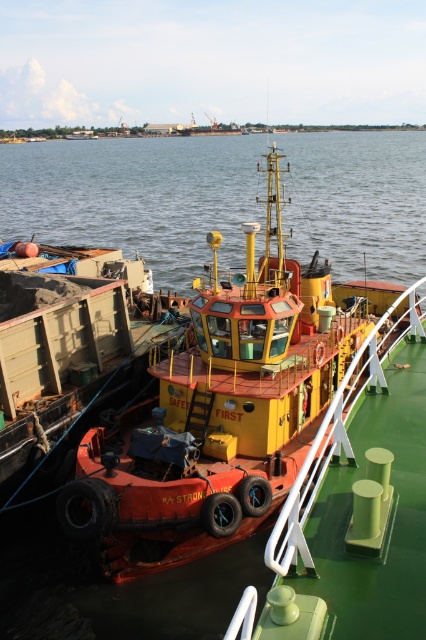
Does orange rubber boat at center appear on the left side of clear water at center?

No, orange rubber boat at center is not to the left of clear water at center.

Can you confirm if orange rubber boat at center is taller than clear water at center?

In fact, orange rubber boat at center may be shorter than clear water at center.

Does point (244, 509) come farther from viewer compared to point (389, 273)?

No.

You are a GUI agent. You are given a task and a screenshot of the screen. Output one action in this format:
    pyautogui.click(x=<x>, y=<y>)
    Task: Click on the orange rubber boat at center
    The width and height of the screenshot is (426, 640).
    Given the screenshot: What is the action you would take?
    pyautogui.click(x=222, y=406)

Who is lower down, clear water at center or rusty metal cargo container at left?

rusty metal cargo container at left is below.

What do you see at coordinates (137, 196) in the screenshot? I see `clear water at center` at bounding box center [137, 196].

In order to click on clear water at center in this screenshot , I will do `click(137, 196)`.

Between point (310, 323) and point (43, 257), which one is positioned behind?

The point (43, 257) is more distant.

Describe the element at coordinates (222, 406) in the screenshot. I see `orange rubber boat at center` at that location.

The image size is (426, 640). Identify the location of orange rubber boat at center. (222, 406).